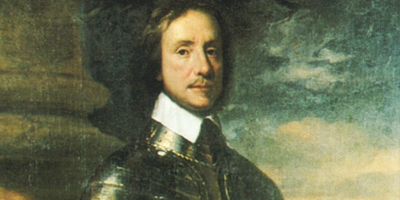
The height and width of the screenshot is (200, 400). In order to click on large column in this screenshot , I will do `click(49, 26)`.